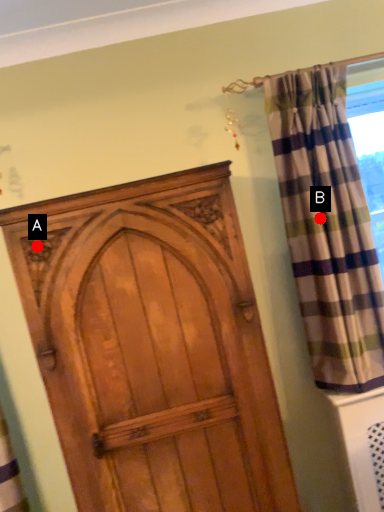
Question: Two points are circled on the image, labeled by A and B beside each circle. Among these points, which one is farthest from the camera?

Choices:
 (A) A is further
 (B) B is further

Answer: (B)